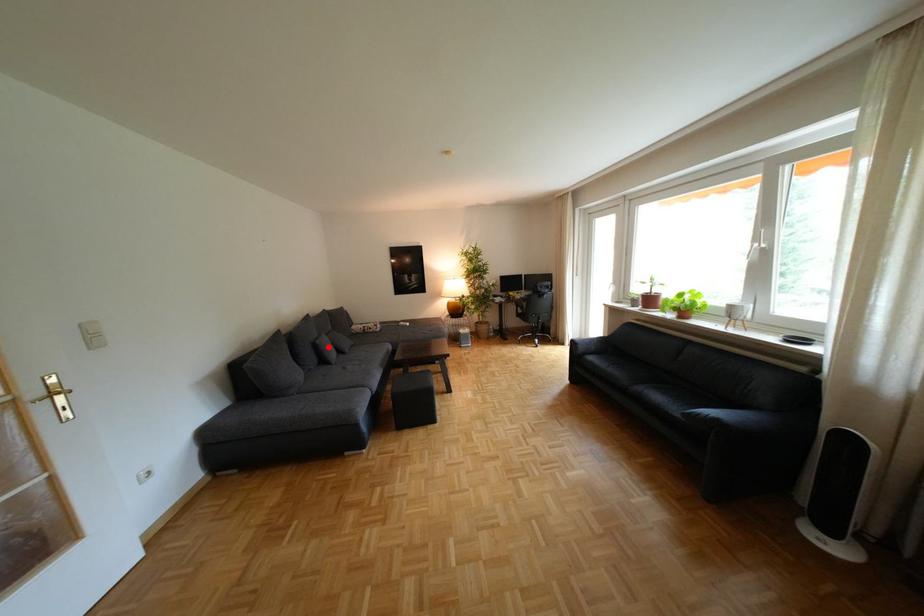
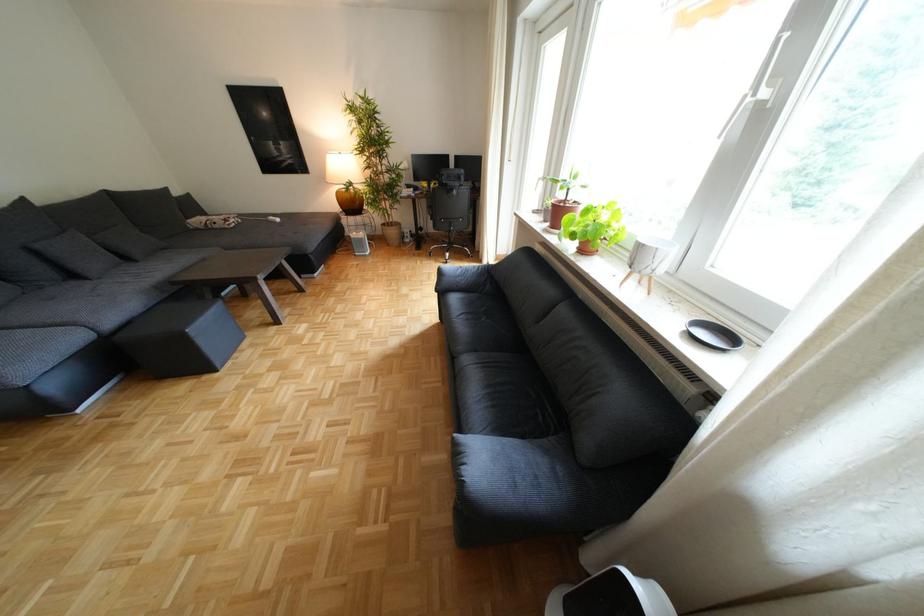
Question: I am providing you with two images of the same scene from different viewpoints. Image1 has a red point marked. In image2, the corresponding 3D location appears at what relative position? Reply with the corresponding letter.

Choices:
 (A) Closer
 (B) Farther

Answer: (B)